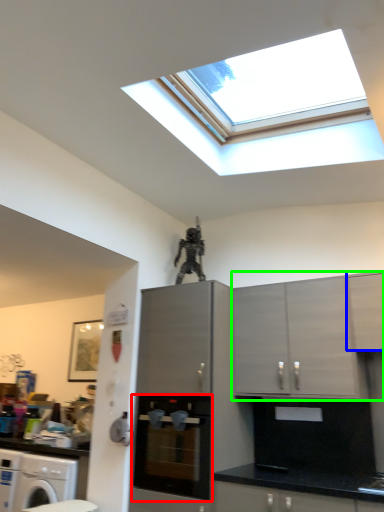
Question: Estimate the real-world distances between objects in this image. Which object is closer to home appliance (highlighted by a red box), cabinetry (highlighted by a blue box) or cabinetry (highlighted by a green box)?

Choices:
 (A) cabinetry
 (B) cabinetry

Answer: (B)